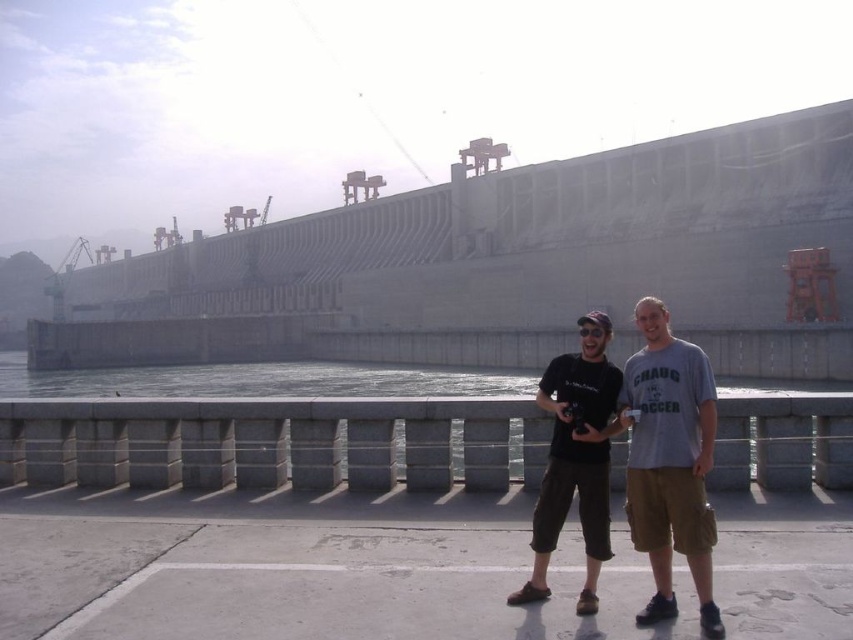
Is gray cotton t-shirt at center wider than matte black t-shirt at center?

Yes.

The width and height of the screenshot is (853, 640). What do you see at coordinates (669, 461) in the screenshot? I see `gray cotton t-shirt at center` at bounding box center [669, 461].

Where is `gray cotton t-shirt at center`? The image size is (853, 640). gray cotton t-shirt at center is located at coordinates (669, 461).